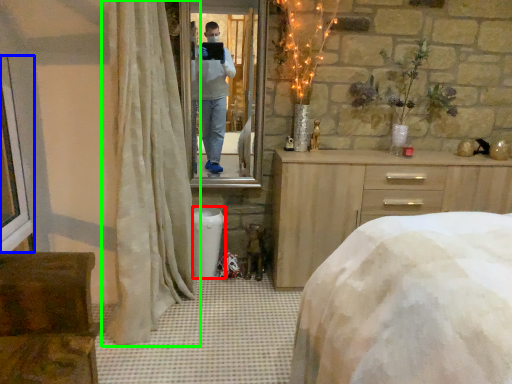
Question: Estimate the real-world distances between objects in this image. Which object is farther from trash bin/can (highlighted by a red box), window frame (highlighted by a blue box) or curtain (highlighted by a green box)?

Choices:
 (A) window frame
 (B) curtain

Answer: (A)